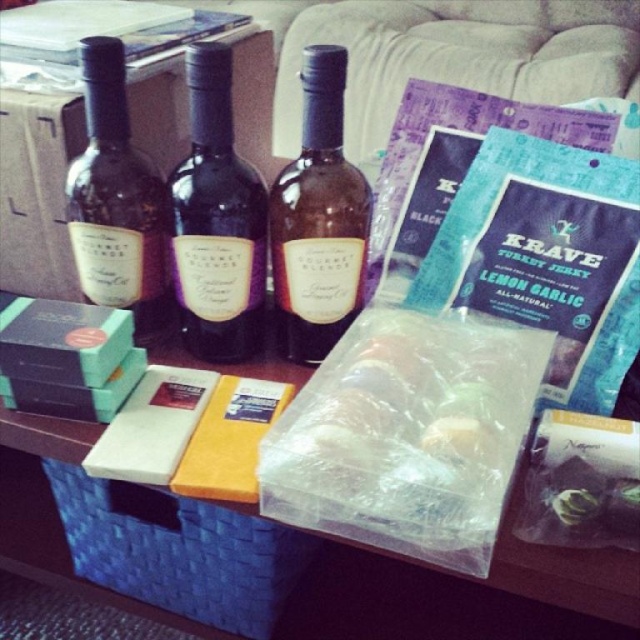
Question: Which object is the closest to the translucent plastic bag at center?

Choices:
 (A) matte black wine bottle at left
 (B) blue woven basket at lower left

Answer: (B)

Question: Can you confirm if blue woven basket at lower left is thinner than matte purple bottle at center?

Choices:
 (A) no
 (B) yes

Answer: (A)

Question: Can you confirm if translucent plastic bag at center is smaller than blue woven basket at lower left?

Choices:
 (A) no
 (B) yes

Answer: (B)

Question: Where is blue woven basket at lower left located in relation to brown glass bottle at center in the image?

Choices:
 (A) above
 (B) below

Answer: (B)

Question: Which point is closer to the camera?

Choices:
 (A) matte purple bottle at center
 (B) translucent plastic bag at center
 (C) blue woven basket at lower left

Answer: (B)

Question: Considering the real-world distances, which object is closest to the matte black wine bottle at left?

Choices:
 (A) translucent plastic bag at center
 (B) brown glass bottle at center
 (C) blue woven basket at lower left

Answer: (B)